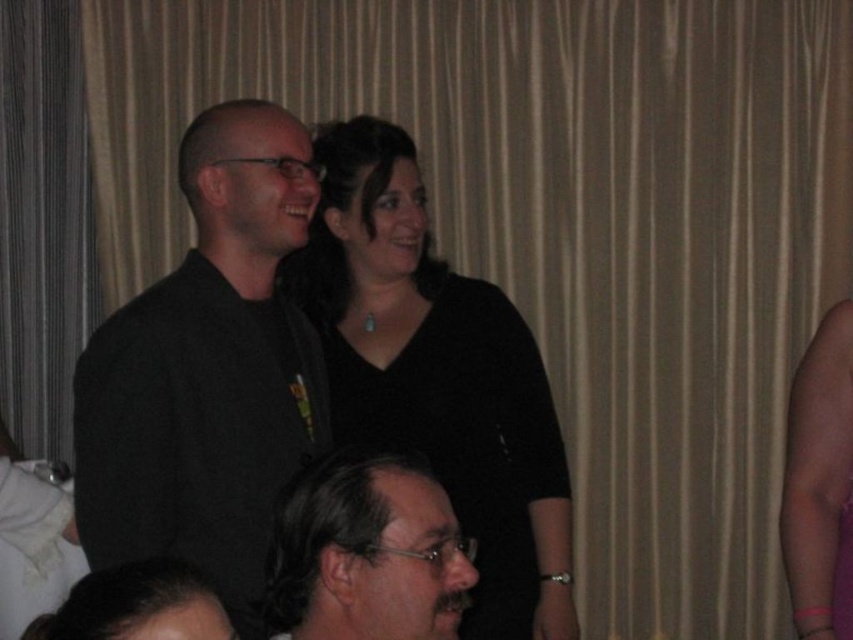
From the picture: Is black matte shirt at center shorter than dark brown hair at lower center?

No, black matte shirt at center is not shorter than dark brown hair at lower center.

Who is higher up, black matte shirt at center or dark brown hair at lower center?

black matte shirt at center

Does point (347, 227) lie behind point (299, 497)?

Yes, point (347, 227) is farther from viewer.

You are a GUI agent. You are given a task and a screenshot of the screen. Output one action in this format:
    pyautogui.click(x=<x>, y=<y>)
    Task: Click on the black matte shirt at center
    The height and width of the screenshot is (640, 853).
    Given the screenshot: What is the action you would take?
    pyautogui.click(x=437, y=376)

Measure the distance from black matte shirt at left to dark brown hair at lower center.

The distance of black matte shirt at left from dark brown hair at lower center is 47.53 centimeters.

Is black matte shirt at left thinner than dark brown hair at lower center?

No.

This screenshot has height=640, width=853. What do you see at coordinates (207, 371) in the screenshot? I see `black matte shirt at left` at bounding box center [207, 371].

Locate an element on the screen. black matte shirt at left is located at coordinates (207, 371).

Can you confirm if black matte shirt at left is shorter than black matte shirt at center?

Yes, black matte shirt at left is shorter than black matte shirt at center.

Locate an element on the screen. This screenshot has width=853, height=640. black matte shirt at left is located at coordinates (207, 371).

You are a GUI agent. You are given a task and a screenshot of the screen. Output one action in this format:
    pyautogui.click(x=<x>, y=<y>)
    Task: Click on the black matte shirt at left
    
    Given the screenshot: What is the action you would take?
    (x=207, y=371)